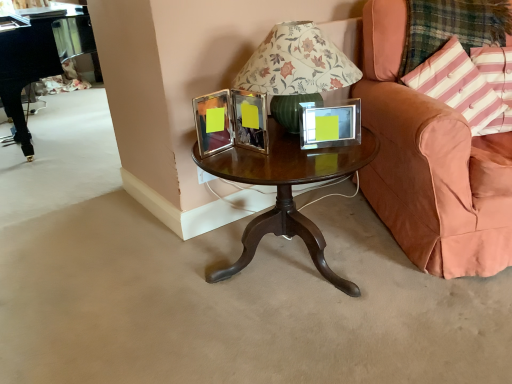
The height and width of the screenshot is (384, 512). Identify the location of metallic floral lampshade at center. (295, 70).

The width and height of the screenshot is (512, 384). What do you see at coordinates (496, 82) in the screenshot? I see `pink striped fabric pillow at right, which is counted as the first pillow, starting from the right` at bounding box center [496, 82].

Describe the element at coordinates (330, 125) in the screenshot. I see `clear glass picture frame at center` at that location.

Describe the element at coordinates (469, 84) in the screenshot. I see `pink striped fabric pillow at upper right, the first pillow from the left` at that location.

The height and width of the screenshot is (384, 512). I want to click on plaid fabric at right, so click(x=452, y=27).

From the image's perspective, would you say plaid fabric at right is positioned over black polished piano at left?

No, from the image's perspective, plaid fabric at right is not above black polished piano at left.

Is plaid fabric at right situated inside black polished piano at left or outside?

plaid fabric at right exists outside the volume of black polished piano at left.

Which object is thinner, plaid fabric at right or black polished piano at left?

Thinner between the two is plaid fabric at right.

Which of these two, plaid fabric at right or black polished piano at left, stands taller?

black polished piano at left is taller.

Is the surface of black polished piano at left in direct contact with metallic floral lampshade at center?

black polished piano at left is not next to metallic floral lampshade at center, and they're not touching.

From a real-world perspective, is black polished piano at left positioned above or below metallic floral lampshade at center?

black polished piano at left is below metallic floral lampshade at center.

Which point is more forward, (x=22, y=123) or (x=331, y=87)?

Point (x=331, y=87)

Is black polished piano at left not inside metallic floral lampshade at center?

Yes, black polished piano at left is not within metallic floral lampshade at center.

How distant is peach velvet chair at right from plaid fabric at right?

peach velvet chair at right and plaid fabric at right are 14.67 inches apart from each other.

From the picture: Is peach velvet chair at right in front of plaid fabric at right?

Yes, the depth of peach velvet chair at right is less than that of plaid fabric at right.

Can you confirm if peach velvet chair at right is positioned to the right of plaid fabric at right?

Yes.

Looking at the image, does peach velvet chair at right seem bigger or smaller compared to plaid fabric at right?

Clearly, peach velvet chair at right is larger in size than plaid fabric at right.

Considering the sizes of objects clear glass picture frame at center and mahogany wood coffee table at center in the image provided, who is bigger, clear glass picture frame at center or mahogany wood coffee table at center?

mahogany wood coffee table at center.

In the image, there is a clear glass picture frame at center. At what (x,y) coordinates should I click in order to perform the action: click on coffee table below it (from the image's perspective). Please return your answer as a coordinate pair (x, y). The width and height of the screenshot is (512, 384). Looking at the image, I should click on (287, 191).

From the image's perspective, between clear glass picture frame at center and mahogany wood coffee table at center, who is located below?

mahogany wood coffee table at center is shown below in the image.

Who is more distant, clear glass picture frame at center or mahogany wood coffee table at center?

clear glass picture frame at center is further from the camera.

Are peach velvet chair at right and clear glass picture frame at center located far from each other?

Actually, peach velvet chair at right and clear glass picture frame at center are a little close together.

From the image's perspective, which one is positioned higher, peach velvet chair at right or clear glass picture frame at center?

From the image's view, peach velvet chair at right is above.

From the picture: Considering the relative sizes of peach velvet chair at right and clear glass picture frame at center in the image provided, is peach velvet chair at right wider than clear glass picture frame at center?

Correct, the width of peach velvet chair at right exceeds that of clear glass picture frame at center.

Relative to peach velvet chair at right, is metallic floral lampshade at center in front or behind?

metallic floral lampshade at center is behind peach velvet chair at right.

Would you consider metallic floral lampshade at center to be distant from peach velvet chair at right?

No, metallic floral lampshade at center is in close proximity to peach velvet chair at right.

Could peach velvet chair at right be considered to be inside metallic floral lampshade at center?

No, metallic floral lampshade at center does not contain peach velvet chair at right.

Considering the sizes of objects metallic floral lampshade at center and peach velvet chair at right in the image provided, who is smaller, metallic floral lampshade at center or peach velvet chair at right?

metallic floral lampshade at center.

Is peach velvet chair at right situated inside pink striped fabric pillow at upper right, the first pillow from the left, or outside?

peach velvet chair at right is spatially situated outside pink striped fabric pillow at upper right, the first pillow from the left.

Which is closer, (473, 207) or (424, 74)?

Point (473, 207)

Does peach velvet chair at right turn towards pink striped fabric pillow at upper right, the second pillow from the right?

Yes, peach velvet chair at right faces towards pink striped fabric pillow at upper right, the second pillow from the right.

Where is `plaid in front of the black polished piano at left`? plaid in front of the black polished piano at left is located at coordinates (452, 27).

This screenshot has width=512, height=384. Identify the location of piano below the metallic floral lampshade at center (from a real-world perspective). (38, 60).

When comparing their distances from pink striped fabric pillow at right, which is counted as the first pillow, starting from the right, does black polished piano at left or clear glass picture frame at center seem further?

black polished piano at left is further to pink striped fabric pillow at right, which is counted as the first pillow, starting from the right.

Considering their positions, is pink striped fabric pillow at upper right, the first pillow from the left, positioned closer to mahogany wood coffee table at center than pink striped fabric pillow at right, which is counted as the first pillow, starting from the right?

Among the two, pink striped fabric pillow at upper right, the first pillow from the left, is located nearer to mahogany wood coffee table at center.

Estimate the real-world distances between objects in this image. Which object is further from black polished piano at left, peach velvet chair at right or pink striped fabric pillow at upper right, the second pillow from the right?

pink striped fabric pillow at upper right, the second pillow from the right, lies further to black polished piano at left than the other object.

Based on their spatial positions, is plaid fabric at right or black polished piano at left further from pink striped fabric pillow at right, which is counted as the first pillow, starting from the right?

black polished piano at left.

Which object lies nearer to the anchor point metallic floral lampshade at center, black polished piano at left or mahogany wood coffee table at center?

mahogany wood coffee table at center lies closer to metallic floral lampshade at center than the other object.

Estimate the real-world distances between objects in this image. Which object is further from plaid fabric at right, mahogany wood coffee table at center or clear glass picture frame at center?

mahogany wood coffee table at center.

From the image, which object appears to be farther from peach velvet chair at right, metallic floral lampshade at center or pink striped fabric pillow at upper right, the first pillow from the left?

metallic floral lampshade at center.

Looking at this image, which object lies further to the anchor point metallic floral lampshade at center, peach velvet chair at right or plaid fabric at right?

Among the two, plaid fabric at right is located further to metallic floral lampshade at center.

You are a GUI agent. You are given a task and a screenshot of the screen. Output one action in this format:
    pyautogui.click(x=<x>, y=<y>)
    Task: Click on the picture frame between black polished piano at left and peach velvet chair at right from left to right
    
    Given the screenshot: What is the action you would take?
    pyautogui.click(x=330, y=125)

Locate an element on the screen. This screenshot has width=512, height=384. chair situated between metallic floral lampshade at center and pink striped fabric pillow at right, which is counted as the first pillow, starting from the right, from left to right is located at coordinates (431, 164).

In order to click on coffee table located between black polished piano at left and peach velvet chair at right in the left-right direction in this screenshot , I will do point(287,191).

I want to click on pillow located between black polished piano at left and peach velvet chair at right in the left-right direction, so click(x=469, y=84).